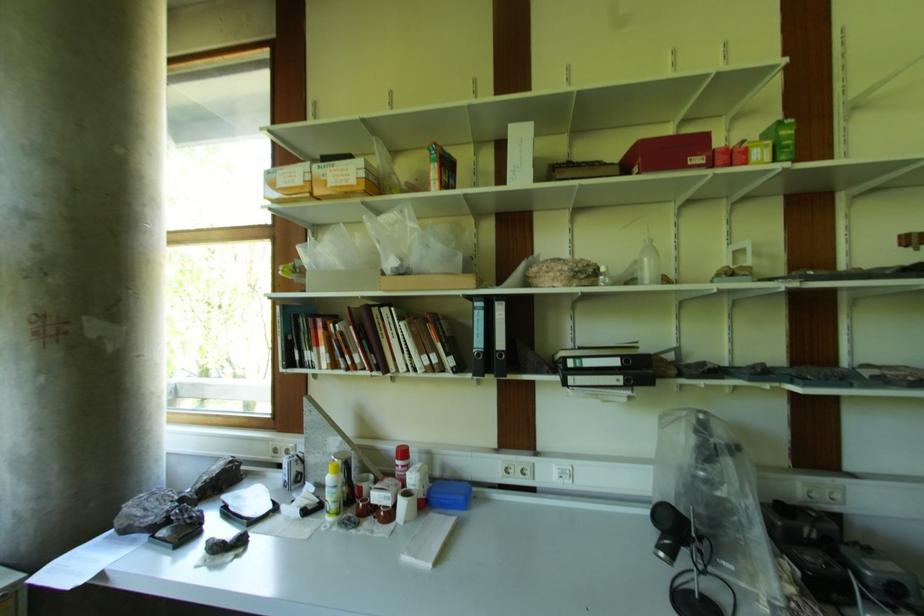
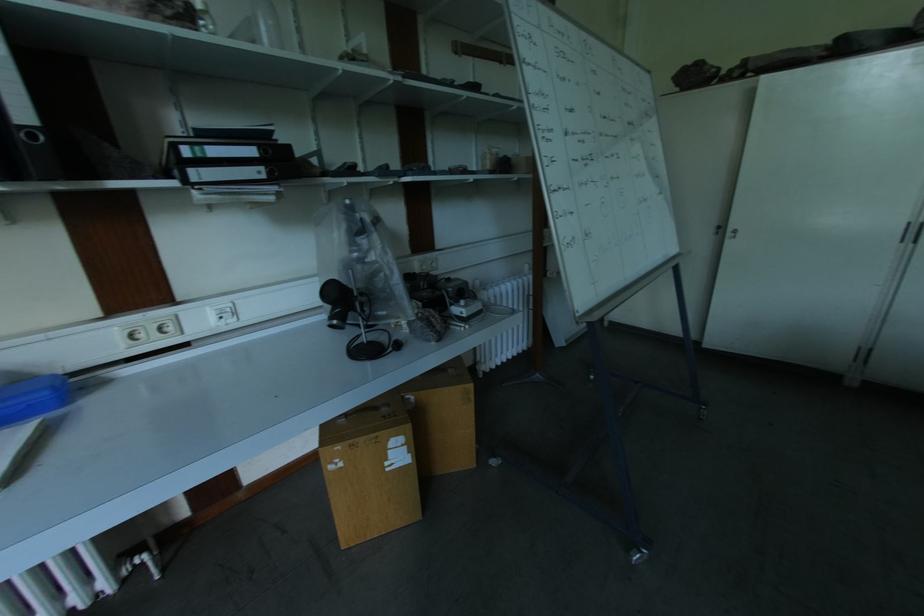
The point at [568,466] is marked in the first image. Where is the corresponding point in the second image?

(226, 304)